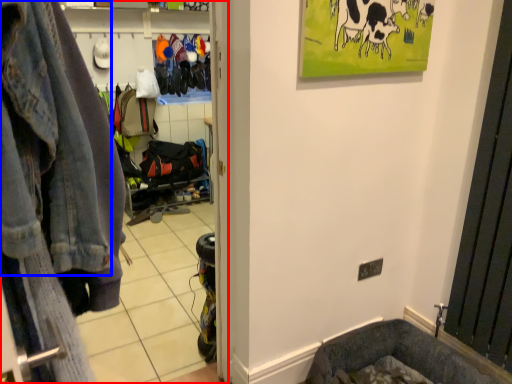
Question: Which object appears farthest to the camera in this image, clothing store (highlighted by a red box) or denim jacket (highlighted by a blue box)?

Choices:
 (A) clothing store
 (B) denim jacket

Answer: (A)